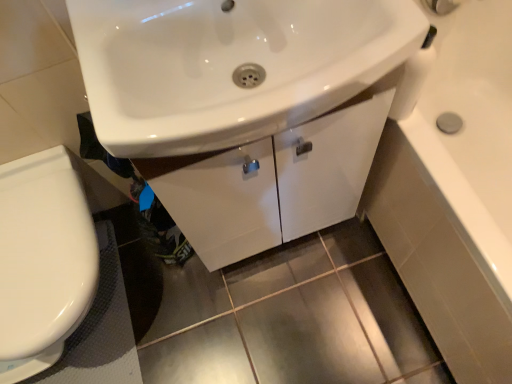
You are a GUI agent. You are given a task and a screenshot of the screen. Output one action in this format:
    pyautogui.click(x=<x>, y=<y>)
    Task: Click on the vacant area that is in front of white glossy cabinet at center
    
    Given the screenshot: What is the action you would take?
    pyautogui.click(x=293, y=319)